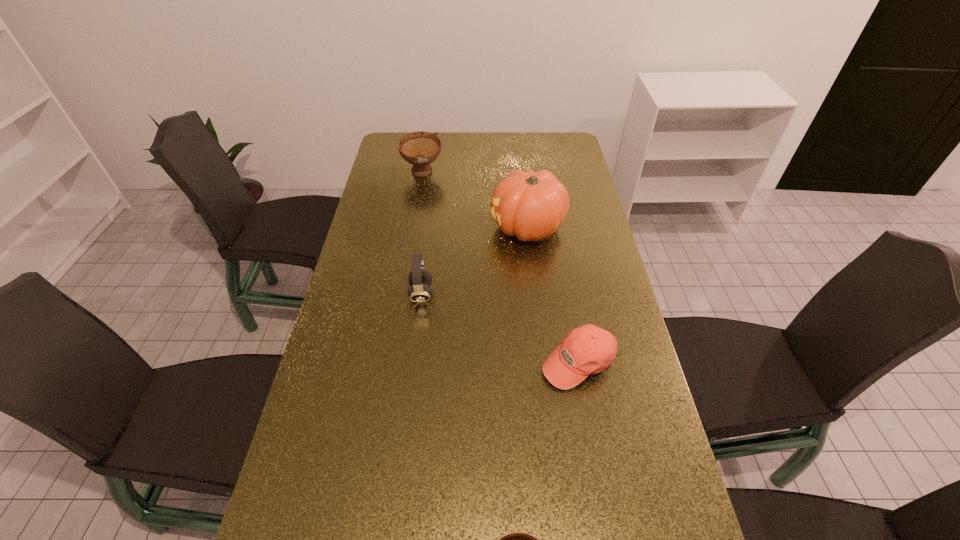
Where is `free region located 0.280m on the front of the farthest object`? The height and width of the screenshot is (540, 960). free region located 0.280m on the front of the farthest object is located at coordinates (413, 232).

The image size is (960, 540). I want to click on vacant space located 0.380m on the ear cups of the third farthest object, so (562, 294).

Where is `vacant space situated on the back of the baseball cap`? Image resolution: width=960 pixels, height=540 pixels. vacant space situated on the back of the baseball cap is located at coordinates (564, 282).

Where is `object at the left edge`? object at the left edge is located at coordinates (420, 148).

In order to click on pumpkin located in the right edge section of the desktop in this screenshot , I will do `click(530, 205)`.

This screenshot has height=540, width=960. I want to click on baseball cap situated at the right edge, so click(588, 349).

At what (x,y) coordinates should I click in order to perform the action: click on vacant space at the far edge. Please return your answer as a coordinate pair (x, y). The width and height of the screenshot is (960, 540). Looking at the image, I should click on (500, 159).

Locate an element on the screen. Image resolution: width=960 pixels, height=540 pixels. vacant area at the left edge of the desktop is located at coordinates (306, 431).

I want to click on vacant region at the right edge, so click(x=661, y=433).

You are a GUI agent. You are given a task and a screenshot of the screen. Output one action in this format:
    pyautogui.click(x=<x>, y=<y>)
    Task: Click on the vacant area at the far left corner
    The width and height of the screenshot is (960, 540).
    Given the screenshot: What is the action you would take?
    pyautogui.click(x=406, y=161)